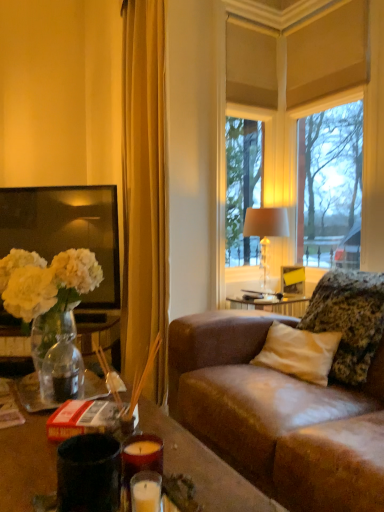
Question: Can you confirm if fluffy textured pillow at right is smaller than translucent glass vase at left?

Choices:
 (A) no
 (B) yes

Answer: (A)

Question: Is fluffy textured pillow at right oriented away from translucent glass vase at left?

Choices:
 (A) no
 (B) yes

Answer: (A)

Question: From the image's perspective, is fluffy textured pillow at right on translucent glass vase at left?

Choices:
 (A) no
 (B) yes

Answer: (A)

Question: From the image's perspective, would you say fluffy textured pillow at right is shown under translucent glass vase at left?

Choices:
 (A) yes
 (B) no

Answer: (A)

Question: Considering the relative sizes of fluffy textured pillow at right and translucent glass vase at left in the image provided, is fluffy textured pillow at right bigger than translucent glass vase at left?

Choices:
 (A) yes
 (B) no

Answer: (A)

Question: Can you confirm if fluffy textured pillow at right is wider than translucent glass vase at left?

Choices:
 (A) yes
 (B) no

Answer: (A)

Question: Is matte red candle at lower center positioned with its back to fluffy textured pillow at right?

Choices:
 (A) yes
 (B) no

Answer: (A)

Question: Does matte red candle at lower center lie behind fluffy textured pillow at right?

Choices:
 (A) no
 (B) yes

Answer: (A)

Question: Are matte red candle at lower center and fluffy textured pillow at right far apart?

Choices:
 (A) no
 (B) yes

Answer: (B)

Question: Is matte red candle at lower center thinner than fluffy textured pillow at right?

Choices:
 (A) no
 (B) yes

Answer: (B)

Question: Is matte red candle at lower center at the left side of fluffy textured pillow at right?

Choices:
 (A) no
 (B) yes

Answer: (B)

Question: Can we say matte red candle at lower center lies outside fluffy textured pillow at right?

Choices:
 (A) yes
 (B) no

Answer: (A)

Question: Can you confirm if translucent glass vase at left is thinner than clear glass window at center?

Choices:
 (A) no
 (B) yes

Answer: (A)